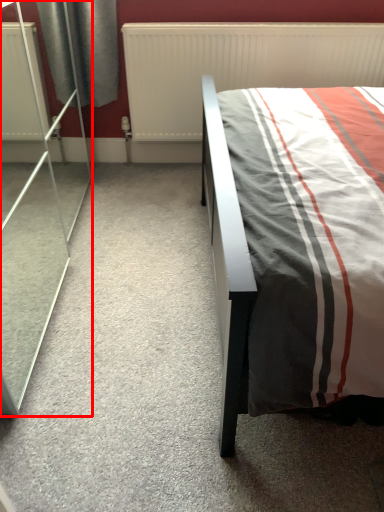
Question: In this image, where is screen door (annotated by the red box) located relative to radiator?

Choices:
 (A) right
 (B) left

Answer: (B)